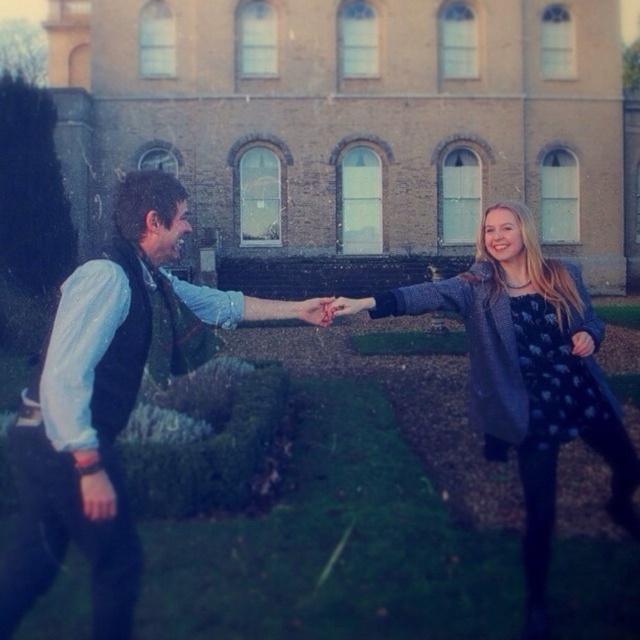
You are standing in the garden and see two points in the image. The first point is at coordinates point (160,292) and the second is at point (534,262). Which point is closer to you?

Point (160,292) is closer to the camera than point (534,262), so the first point is closer to you.

You are a photographer standing in the garden and want to take a photo of both the matte green vest at left and the sparkly silver dress at center. Based on their positions, which one is higher up in the frame?

The matte green vest at left is located above the sparkly silver dress at center, so it is higher up in the frame.